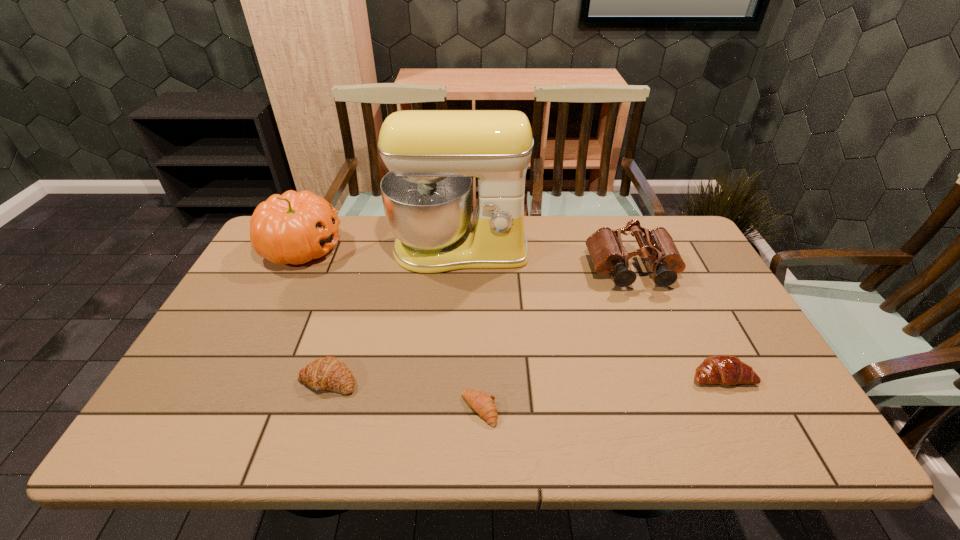
Find the location of a particular element. Image resolution: width=960 pixels, height=540 pixels. vacant area located 0.210m through the eyepieces of the binoculars is located at coordinates (664, 349).

The image size is (960, 540). What are the coordinates of `vacant area located 0.280m on the left of the second object from left to right` in the screenshot? It's located at (180, 380).

Identify the location of vacant point located on the left of the rightmost crescent roll. (593, 376).

Where is `vacant area situated on the right of the shortest crescent roll`? The image size is (960, 540). vacant area situated on the right of the shortest crescent roll is located at coordinates (574, 410).

Where is `mixer at the far edge`? mixer at the far edge is located at coordinates (432, 155).

You are a GUI agent. You are given a task and a screenshot of the screen. Output one action in this format:
    pyautogui.click(x=<x>, y=<y>)
    Task: Click on the pumpkin located in the far edge section of the desktop
    This screenshot has width=960, height=540.
    Given the screenshot: What is the action you would take?
    pyautogui.click(x=293, y=228)

Identify the location of binoculars that is positioned at the far edge. (608, 254).

I want to click on object located in the near edge section of the desktop, so click(x=483, y=404).

At what (x,y) coordinates should I click in order to perform the action: click on object at the left edge. Please return your answer as a coordinate pair (x, y). Looking at the image, I should click on coord(293,228).

Where is `binoculars that is positioned at the right edge`? binoculars that is positioned at the right edge is located at coordinates (608, 254).